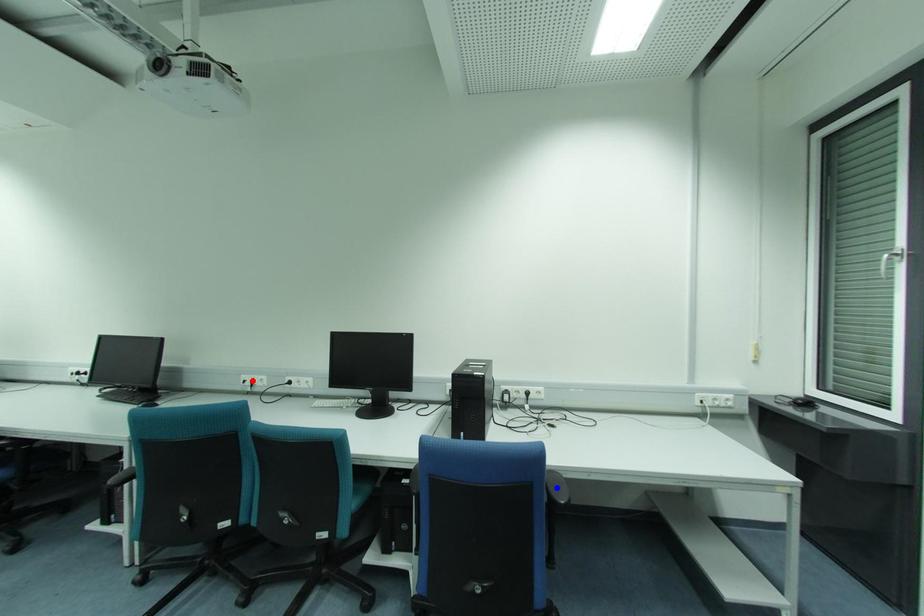
Question: Two points are marked on the image. Which point is closer to the camera?

Choices:
 (A) Blue point is closer.
 (B) Red point is closer.

Answer: (A)